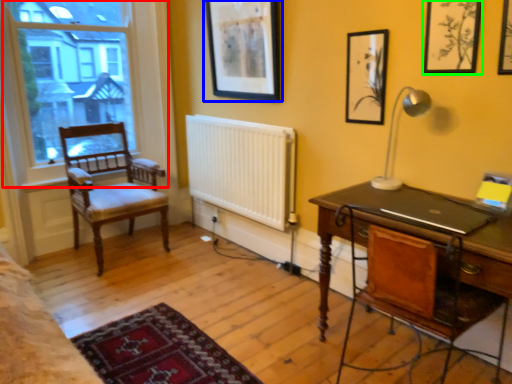
Question: Estimate the real-world distances between objects in this image. Which object is closer to window (highlighted by a red box), picture frame (highlighted by a blue box) or picture frame (highlighted by a green box)?

Choices:
 (A) picture frame
 (B) picture frame

Answer: (A)